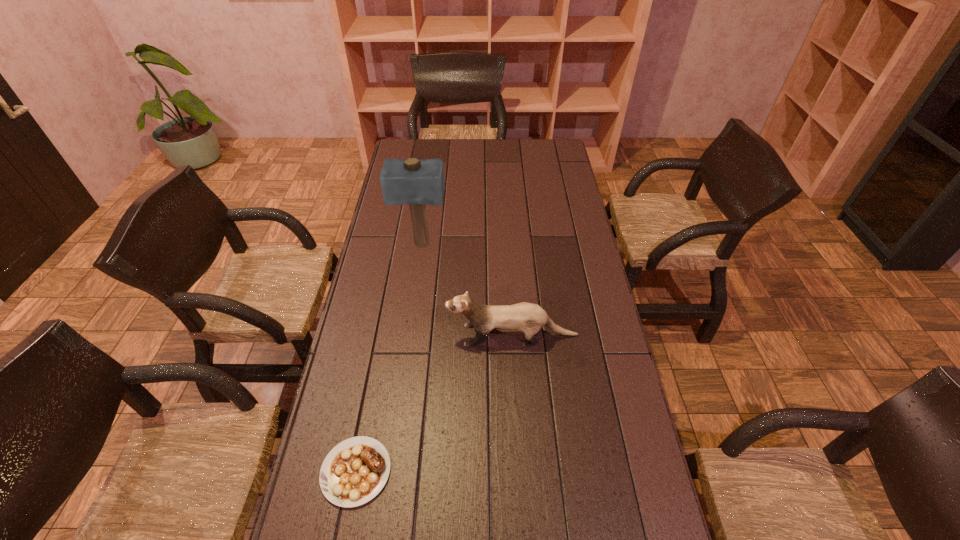
Image resolution: width=960 pixels, height=540 pixels. Find the location of `vacant space in between the rightmost object and the tallest object`. vacant space in between the rightmost object and the tallest object is located at coordinates (467, 290).

Find the location of a particular element. This screenshot has width=960, height=540. vacant space in between the ferret and the mallet is located at coordinates (467, 290).

Locate an element on the screen. This screenshot has width=960, height=540. object that ranks as the second closest to the steak is located at coordinates (410, 181).

Locate which object is the closest to the second nearest object. Please provide its 2D coordinates. Your answer should be formatted as a tuple, i.e. [(x, y)], where the tuple contains the x and y coordinates of a point satisfying the conditions above.

[(354, 471)]

I want to click on free location that satisfies the following two spatial constraints: 1. on the face of the ferret; 2. on the front side of the nearest object, so click(x=521, y=471).

You are a GUI agent. You are given a task and a screenshot of the screen. Output one action in this format:
    pyautogui.click(x=<x>, y=<y>)
    Task: Click on the vacant area that satisfies the following two spatial constraints: 1. on the face of the second shortest object; 2. on the front side of the steak
    
    Given the screenshot: What is the action you would take?
    pyautogui.click(x=521, y=471)